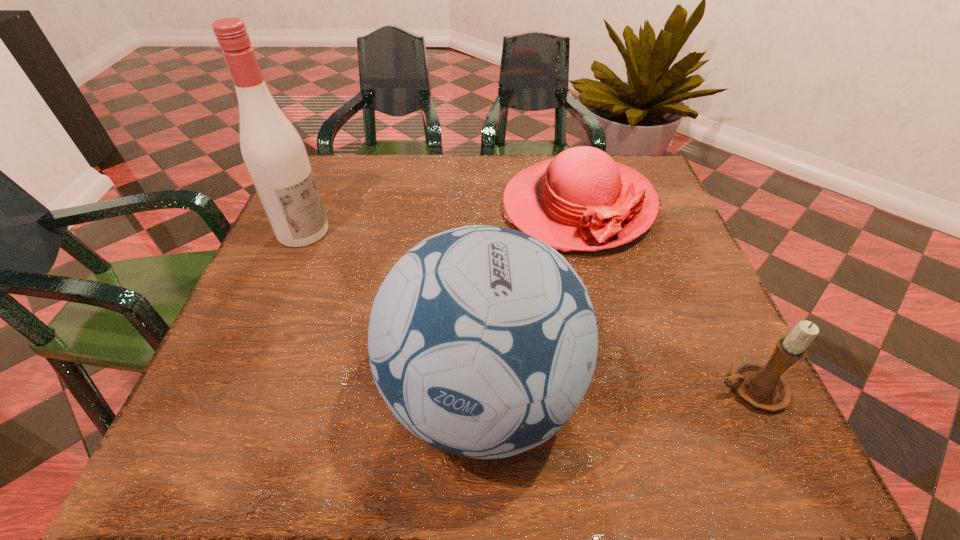
In order to click on soccer ball in this screenshot , I will do `click(482, 340)`.

You are a GUI agent. You are given a task and a screenshot of the screen. Output one action in this format:
    pyautogui.click(x=<x>, y=<y>)
    Task: Click on the third tallest object
    
    Given the screenshot: What is the action you would take?
    pyautogui.click(x=761, y=385)

The image size is (960, 540). What are the coordinates of `hat` in the screenshot? It's located at (582, 200).

Locate an element on the screen. The height and width of the screenshot is (540, 960). the leftmost object is located at coordinates (273, 151).

This screenshot has height=540, width=960. In order to click on alcohol in this screenshot , I will do pyautogui.click(x=273, y=151).

The image size is (960, 540). In order to click on vacant space situated on the side of the candle holder with the handle in this screenshot , I will do `click(555, 389)`.

At what (x,y) coordinates should I click in order to perform the action: click on vacant point located on the side of the candle holder with the handle. Please return your answer as a coordinate pair (x, y). This screenshot has width=960, height=540. Looking at the image, I should click on (626, 389).

Identify the location of blank space located 0.120m on the side of the candle holder with the handle. (643, 389).

You are a GUI agent. You are given a task and a screenshot of the screen. Output one action in this format:
    pyautogui.click(x=<x>, y=<y>)
    Task: Click on the free point located 0.070m at the front of the hat with a bow
    The height and width of the screenshot is (540, 960).
    Given the screenshot: What is the action you would take?
    click(x=598, y=282)

Where is `free space located at the front of the hat with a bow`? This screenshot has width=960, height=540. free space located at the front of the hat with a bow is located at coordinates (616, 350).